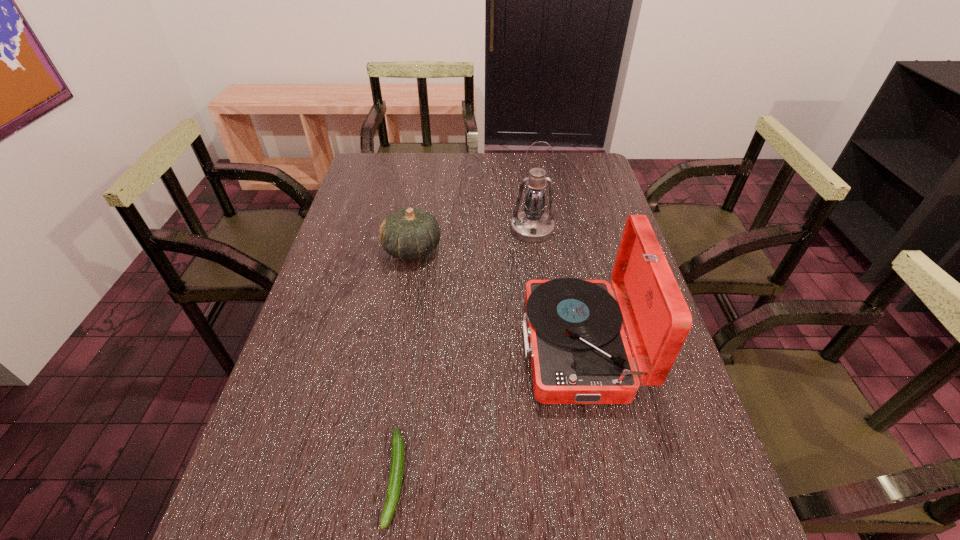
You are a GUI agent. You are given a task and a screenshot of the screen. Output one action in this format:
    pyautogui.click(x=<x>, y=<y>)
    Task: Click on the oil lamp
    This screenshot has width=960, height=540.
    Given the screenshot: What is the action you would take?
    pyautogui.click(x=532, y=225)

Locate an element on the screen. This screenshot has width=960, height=540. phonograph_record is located at coordinates (579, 353).

Find the location of a particular element. gourd is located at coordinates (409, 233).

The width and height of the screenshot is (960, 540). Identify the location of the nearest object. (397, 464).

The height and width of the screenshot is (540, 960). What are the coordinates of `zucchini` in the screenshot? It's located at (397, 464).

Where is `vacant space located on the back of the oil lamp`? The height and width of the screenshot is (540, 960). vacant space located on the back of the oil lamp is located at coordinates (522, 159).

The height and width of the screenshot is (540, 960). Find the location of `vacant area situated on the front-facing side of the phonograph_record`. vacant area situated on the front-facing side of the phonograph_record is located at coordinates (475, 347).

Identify the location of blank space located 0.250m on the front-facing side of the phonograph_record. (422, 347).

Image resolution: width=960 pixels, height=540 pixels. I want to click on free space located 0.330m on the front-facing side of the phonograph_record, so click(x=390, y=347).

At what (x,y) coordinates should I click in order to perform the action: click on blank area located on the back of the gourd. Please return your answer as a coordinate pair (x, y). This screenshot has height=540, width=960. Looking at the image, I should click on (424, 174).